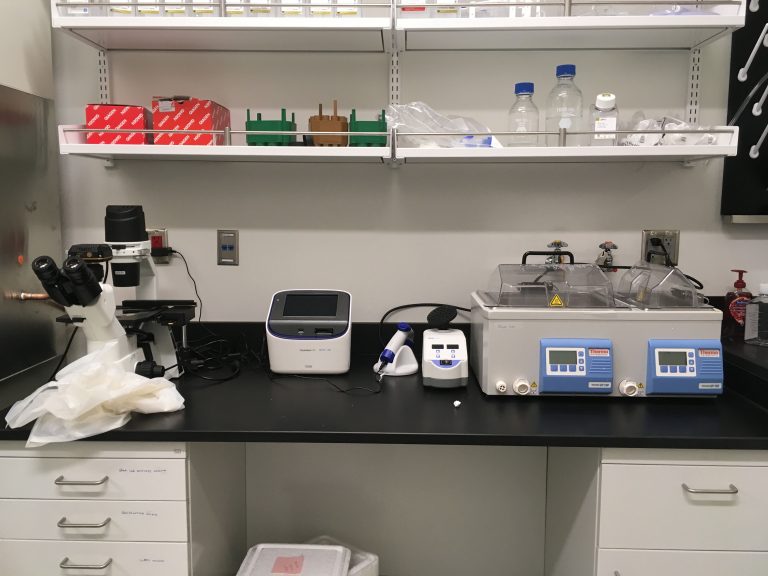
Image resolution: width=768 pixels, height=576 pixels. In order to click on plugged into wall in this screenshot , I will do (160, 252), (656, 241).